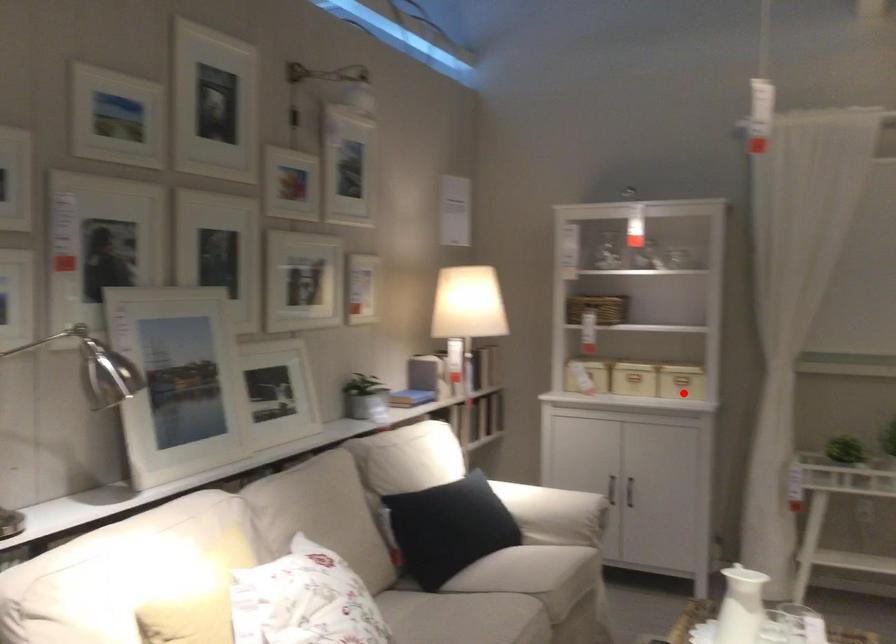
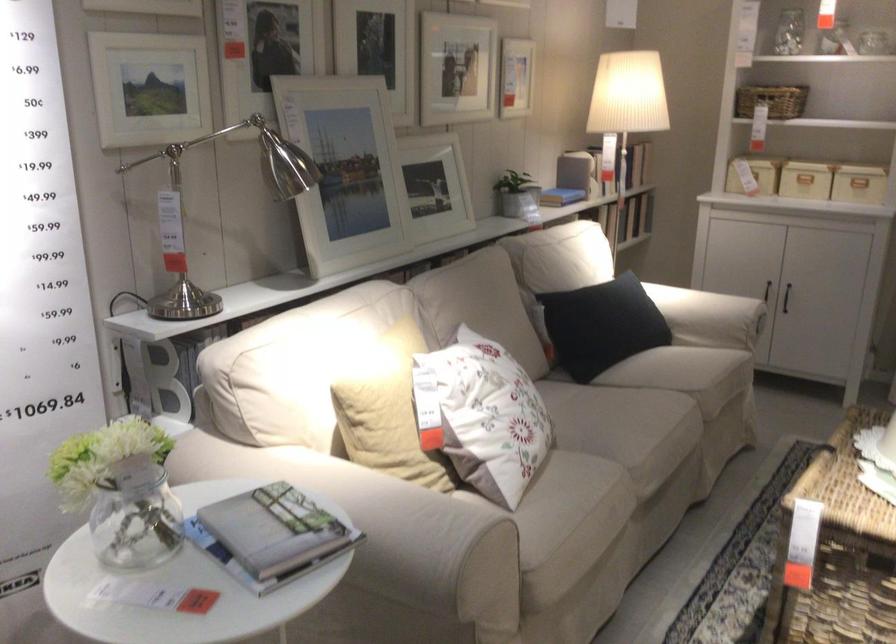
Question: I am providing you with two images of the same scene from different viewpoints. A red point is shown in image1. For the corresponding object point in image2, is it positioned nearer or farther from the camera?

Choices:
 (A) Nearer
 (B) Farther

Answer: (A)